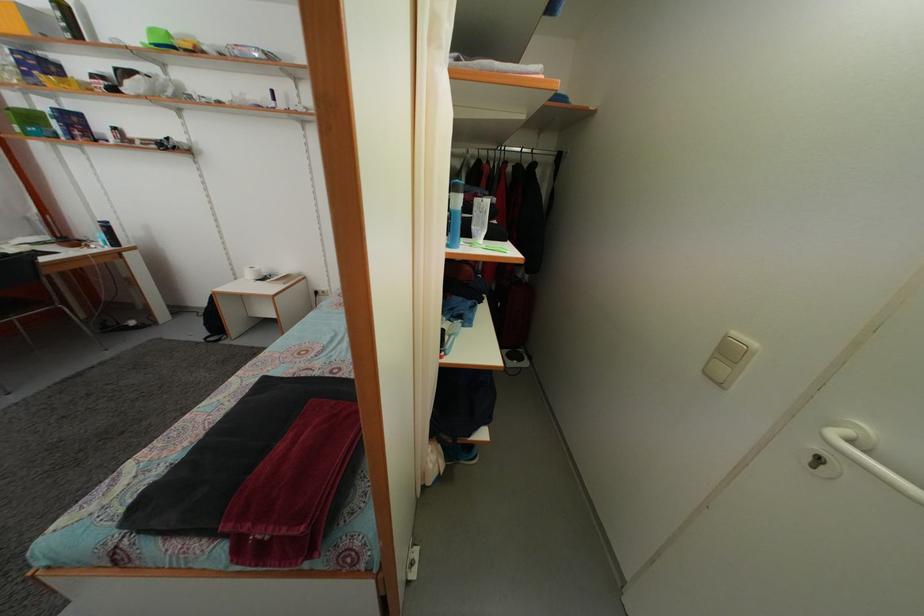
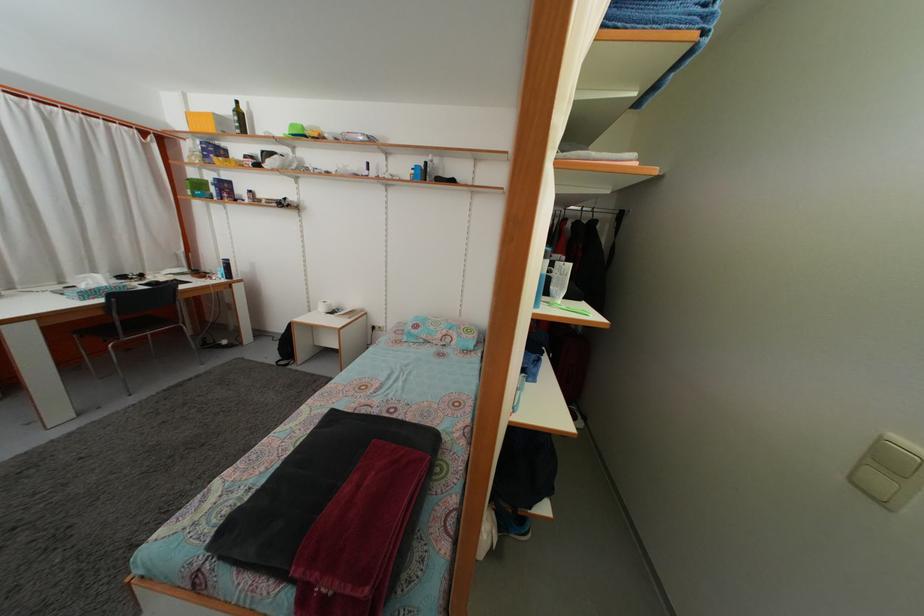
The point at (483,219) is marked in the first image. Where is the corresponding point in the second image?

(564, 282)